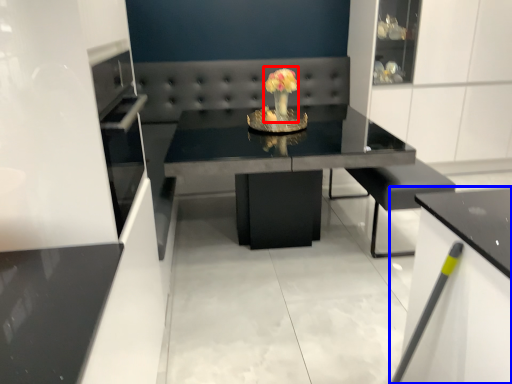
Question: Which object appears closest to the camera in this image, floral arrangement (highlighted by a red box) or cabinetry (highlighted by a blue box)?

Choices:
 (A) floral arrangement
 (B) cabinetry

Answer: (B)